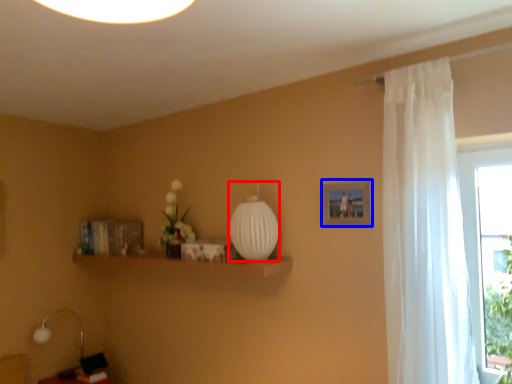
Question: Among these objects, which one is nearest to the camera, glass vase (highlighted by a red box) or picture frame (highlighted by a blue box)?

Choices:
 (A) glass vase
 (B) picture frame

Answer: (B)